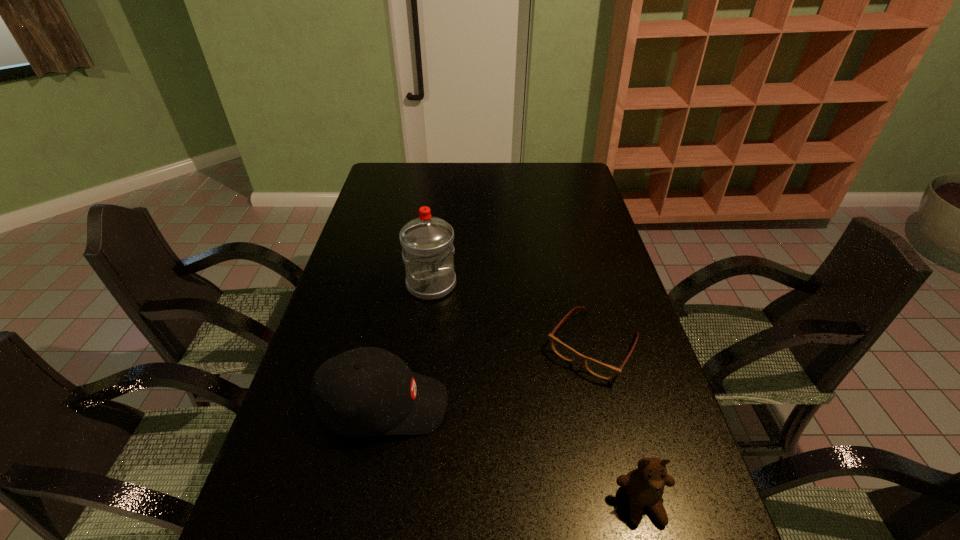
This screenshot has height=540, width=960. I want to click on baseball cap, so click(366, 391).

Locate an element on the screen. This screenshot has height=540, width=960. teddy bear is located at coordinates (645, 485).

Where is `the farthest object`? This screenshot has height=540, width=960. the farthest object is located at coordinates (428, 250).

Image resolution: width=960 pixels, height=540 pixels. Identify the location of water bottle. (428, 250).

Where is `the shortest object`? the shortest object is located at coordinates (604, 371).

Find the location of a particular element. The image size is (960, 540). free space located 0.160m with a logo on the front of the baseball cap is located at coordinates (516, 406).

Where is `blank area located on the handle side of the tallest object`? blank area located on the handle side of the tallest object is located at coordinates (469, 366).

Where is `vacant region located on the handle side of the tallest object`? vacant region located on the handle side of the tallest object is located at coordinates (464, 355).

Locate an element on the screen. vacant region located 0.390m on the handle side of the tallest object is located at coordinates (489, 407).

Locate an element on the screen. vacant space located 0.230m on the front-facing side of the shortest object is located at coordinates (522, 448).